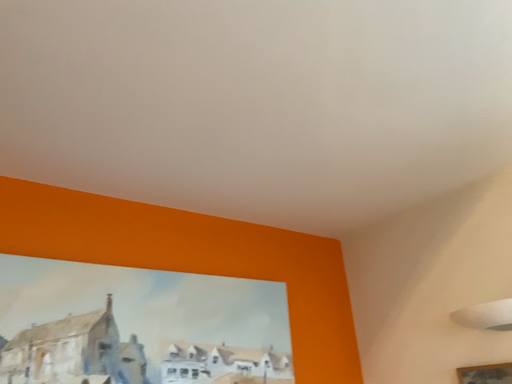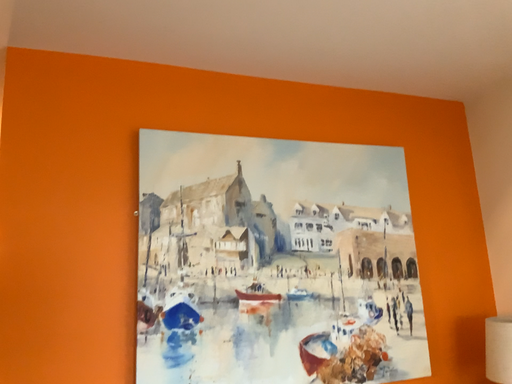
Question: How did the camera likely rotate when shooting the video?

Choices:
 (A) rotated downward
 (B) rotated upward

Answer: (A)